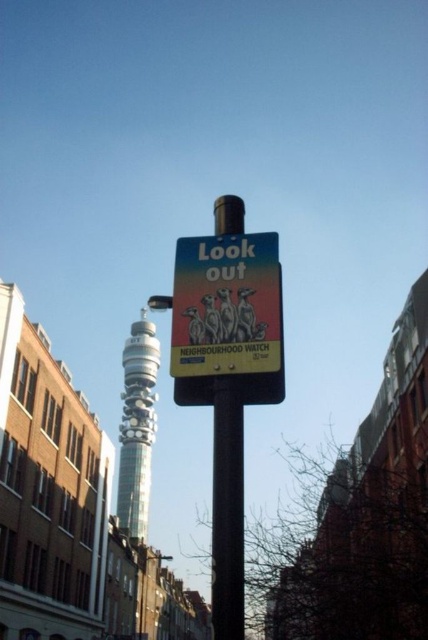
Question: Which point is farther to the camera?

Choices:
 (A) smooth metallic pole at center
 (B) silver metallic bt tower at center

Answer: (B)

Question: Is smooth metallic pole at center bigger than silver metallic bt tower at center?

Choices:
 (A) no
 (B) yes

Answer: (A)

Question: Is smooth metallic pole at center above silver metallic bt tower at center?

Choices:
 (A) yes
 (B) no

Answer: (A)

Question: In this image, where is smooth metallic pole at center located relative to silver metallic bt tower at center?

Choices:
 (A) below
 (B) above

Answer: (B)